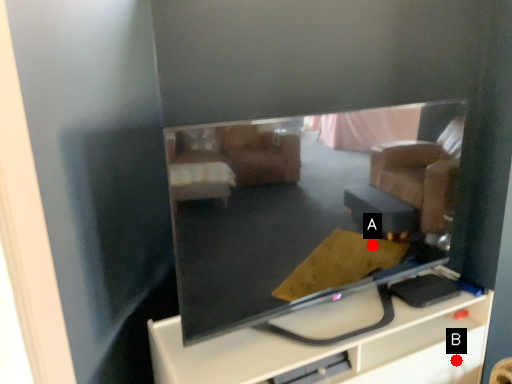
Question: Two points are circled on the image, labeled by A and B beside each circle. Which point is closer to the camera?

Choices:
 (A) A is closer
 (B) B is closer

Answer: (A)